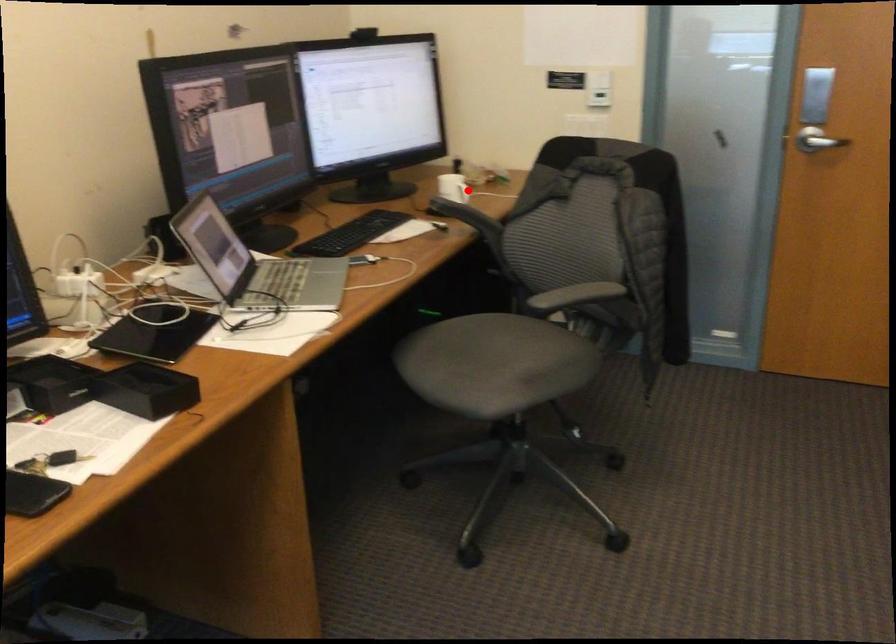
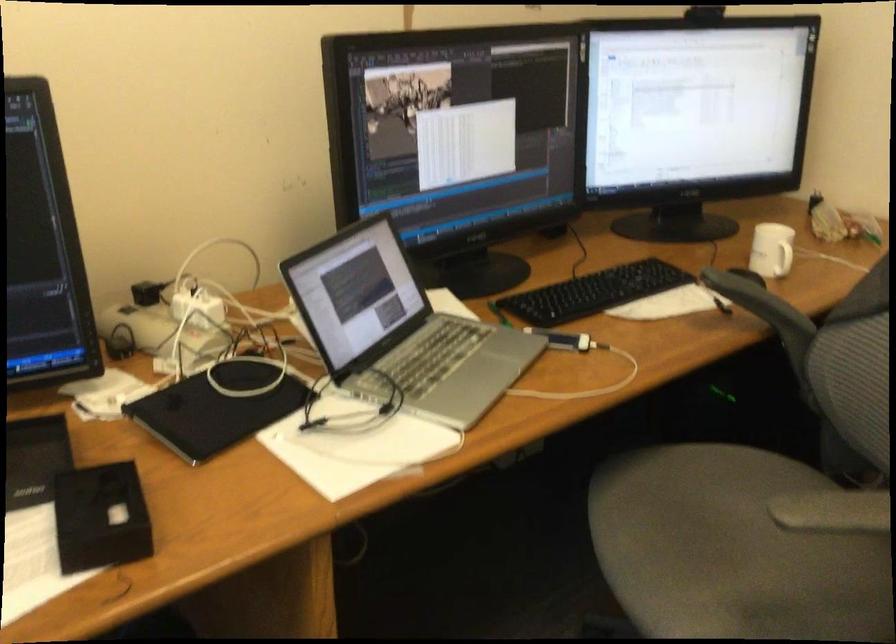
Question: I am providing you with two images of the same scene from different viewpoints. A red point is shown in image1. For the corresponding object point in image2, is it positioned nearer or farther from the camera?

Choices:
 (A) Nearer
 (B) Farther

Answer: (A)